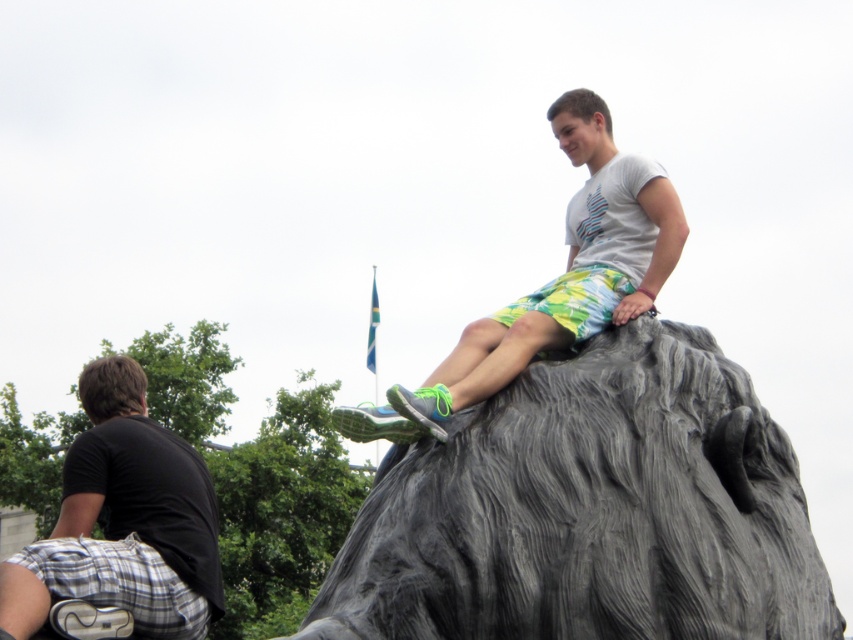
Question: Is gray textured rock at upper center positioned before light gray stone statue at upper center?

Choices:
 (A) yes
 (B) no

Answer: (A)

Question: In this image, where is gray textured rock at upper center located relative to black cotton shirt at lower left?

Choices:
 (A) right
 (B) left

Answer: (A)

Question: Which object is closer to the camera taking this photo?

Choices:
 (A) light gray stone statue at upper center
 (B) gray textured rock at upper center

Answer: (B)

Question: Considering the real-world distances, which object is farthest from the light gray stone statue at upper center?

Choices:
 (A) gray textured rock at upper center
 (B) black cotton shirt at lower left

Answer: (B)

Question: Among these objects, which one is farthest from the camera?

Choices:
 (A) gray textured rock at upper center
 (B) black cotton shirt at lower left

Answer: (B)

Question: Does gray textured rock at upper center have a lesser width compared to black cotton shirt at lower left?

Choices:
 (A) yes
 (B) no

Answer: (B)